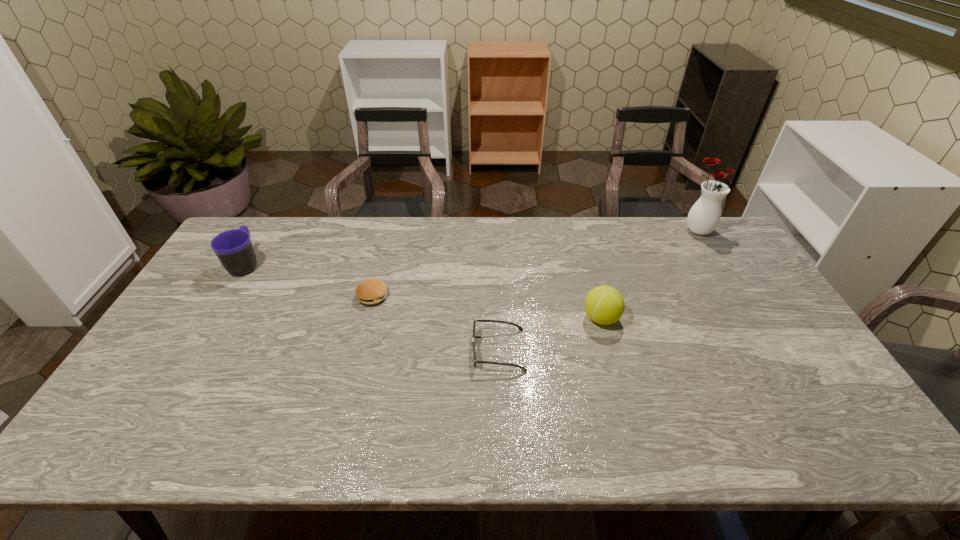
Locate an element on the screen. The height and width of the screenshot is (540, 960). free space between the patty and the leftmost object is located at coordinates (309, 280).

Where is `vacant space that's between the mug and the spectacles`? Image resolution: width=960 pixels, height=540 pixels. vacant space that's between the mug and the spectacles is located at coordinates (372, 307).

You are a GUI agent. You are given a task and a screenshot of the screen. Output one action in this format:
    pyautogui.click(x=<x>, y=<y>)
    Task: Click on the free space between the tennis ball and the vase
    The width and height of the screenshot is (960, 540).
    Given the screenshot: What is the action you would take?
    pyautogui.click(x=649, y=274)

Image resolution: width=960 pixels, height=540 pixels. Find the location of `blank region between the spectacles and the leftmost object`. blank region between the spectacles and the leftmost object is located at coordinates (372, 307).

Image resolution: width=960 pixels, height=540 pixels. In order to click on free space between the mug and the tennis ball in this screenshot , I will do `click(423, 291)`.

Locate an element on the screen. This screenshot has width=960, height=540. vacant area that lies between the fourth nearest object and the rightmost object is located at coordinates (471, 247).

You are a GUI agent. You are given a task and a screenshot of the screen. Output one action in this format:
    pyautogui.click(x=<x>, y=<y>)
    Task: Click on the vacant area between the third object from right to left and the patty
    Image resolution: width=960 pixels, height=540 pixels.
    Given the screenshot: What is the action you would take?
    pyautogui.click(x=435, y=323)

The image size is (960, 540). Identify the location of free point between the second object from right to left and the third object from left to right. (549, 334).

Select which object appears as the third closest to the third object from left to right. Please provide its 2D coordinates. Your answer should be formatted as a tuple, i.e. [(x, y)], where the tuple contains the x and y coordinates of a point satisfying the conditions above.

[(234, 249)]

You are a GUI agent. You are given a task and a screenshot of the screen. Output one action in this format:
    pyautogui.click(x=<x>, y=<y>)
    Task: Click on the object that stands as the closest to the third object from right to left
    The width and height of the screenshot is (960, 540).
    Given the screenshot: What is the action you would take?
    pyautogui.click(x=604, y=305)